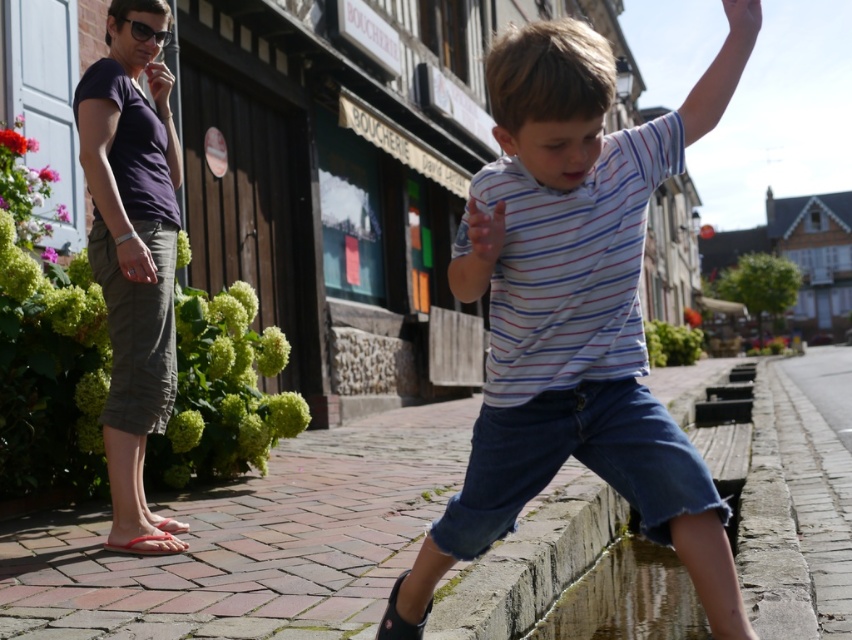
Can you confirm if brick pavement at lower center is bigger than purple cotton shirt at upper left?

Yes, brick pavement at lower center is bigger than purple cotton shirt at upper left.

Is point (56, 556) positioned after point (122, 486)?

No, (56, 556) is closer to viewer.

Where is `brick pavement at lower center`? The height and width of the screenshot is (640, 852). brick pavement at lower center is located at coordinates (252, 544).

Find the location of a particular element. This screenshot has height=640, width=852. brick pavement at lower center is located at coordinates (252, 544).

Does white striped shirt at center appear over purple cotton shirt at upper left?

Actually, white striped shirt at center is below purple cotton shirt at upper left.

Which is below, white striped shirt at center or purple cotton shirt at upper left?

white striped shirt at center is below.

Which is behind, point (551, 205) or point (114, 129)?

The point (114, 129) is behind.

Locate an element on the screen. The height and width of the screenshot is (640, 852). white striped shirt at center is located at coordinates (574, 310).

Is point (628, 452) in front of point (366, 492)?

Yes, it is in front of point (366, 492).

Does white striped shirt at center come behind brick pavement at lower center?

No, it is not.

Is point (501, 300) more distant than point (213, 605)?

No.

Where is `white striped shirt at center`? Image resolution: width=852 pixels, height=640 pixels. white striped shirt at center is located at coordinates tap(574, 310).